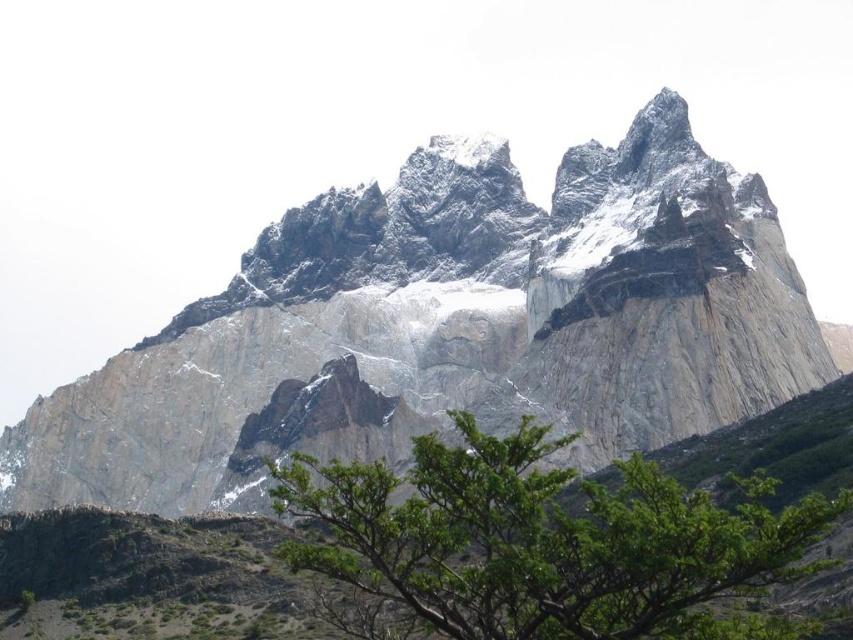
Question: Does rugged stone mountain range at upper center have a larger size compared to green leafy tree at center?

Choices:
 (A) yes
 (B) no

Answer: (A)

Question: Which object is closer to the camera taking this photo?

Choices:
 (A) green leafy tree at center
 (B) rugged stone mountain range at upper center

Answer: (A)

Question: Can you confirm if rugged stone mountain range at upper center is positioned to the right of green leafy tree at center?

Choices:
 (A) yes
 (B) no

Answer: (B)

Question: Does rugged stone mountain range at upper center appear on the left side of green leafy tree at center?

Choices:
 (A) yes
 (B) no

Answer: (A)

Question: Which object appears farthest from the camera in this image?

Choices:
 (A) green leafy tree at center
 (B) rugged stone mountain range at upper center

Answer: (B)